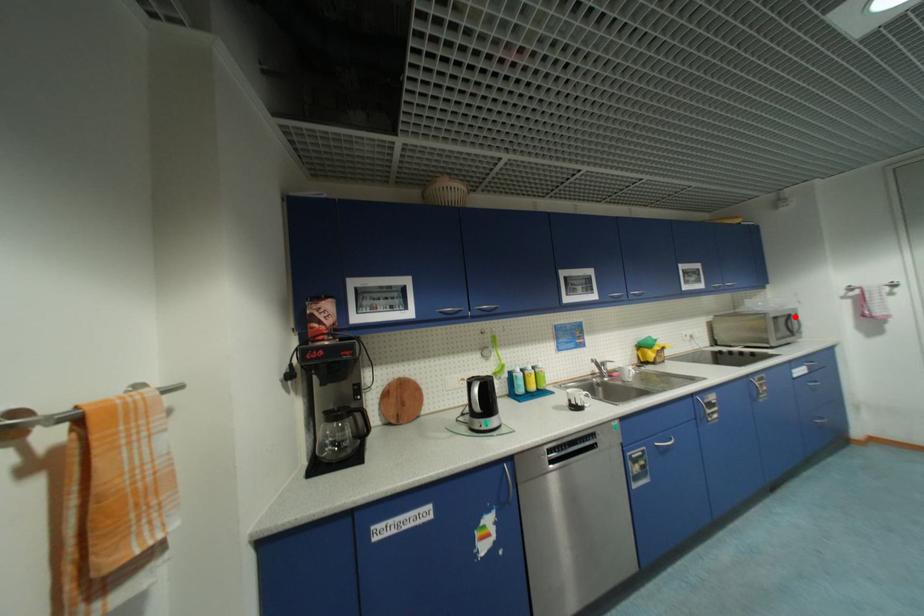
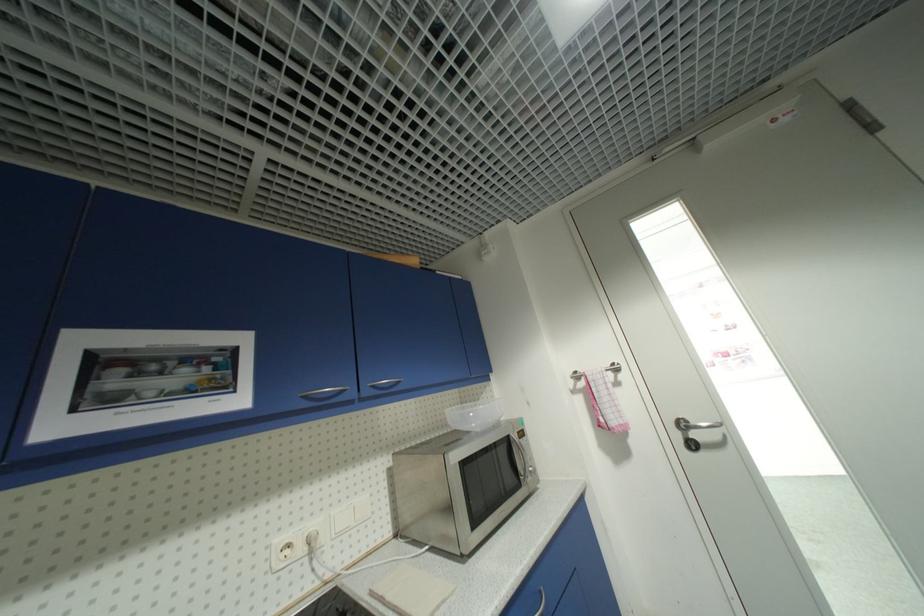
Question: I am providing you with two images of the same scene from different viewpoints. A red point is marked on the first image. At the location where the point appears in image 1, is it still visible in image 2?

Choices:
 (A) Yes
 (B) No

Answer: (A)